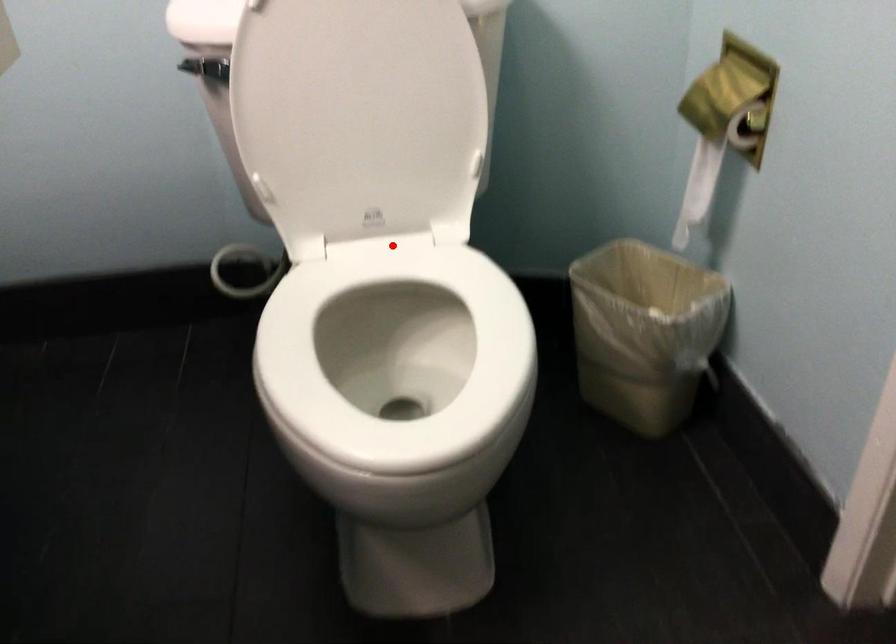
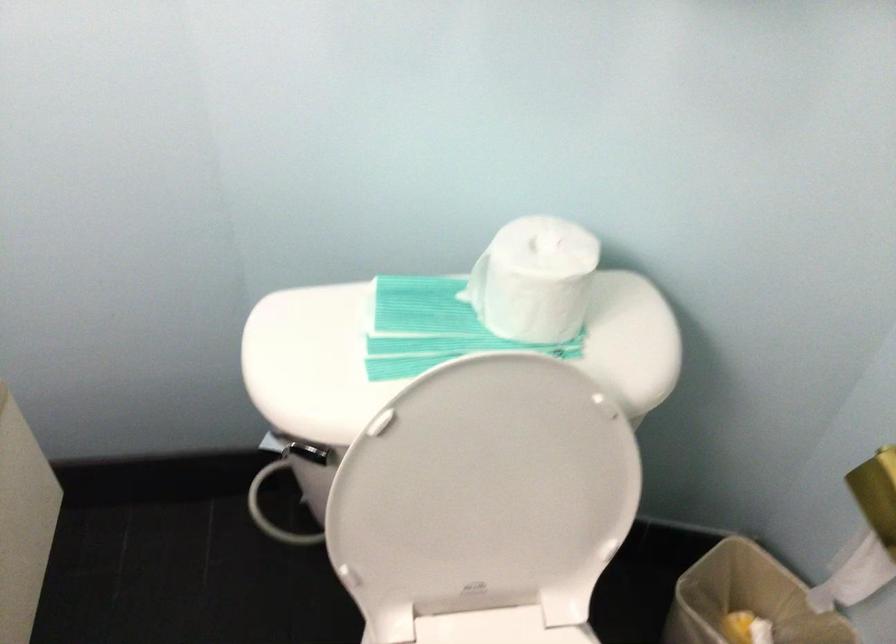
Locate, in the second image, the point that corresponds to the highlighted location in the first image.

(497, 627)